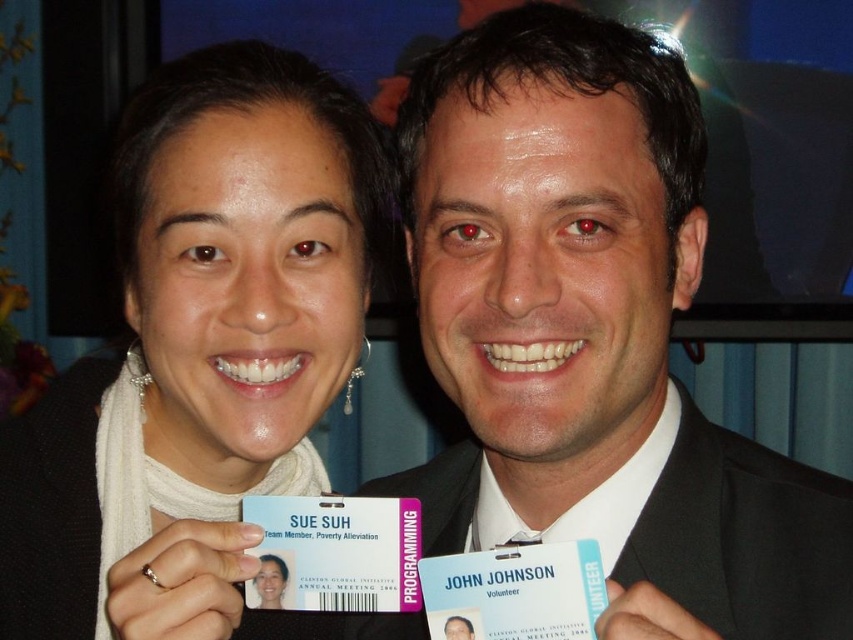
Question: Which object is positioned farthest from the white plastic badge at center?

Choices:
 (A) blue card at center
 (B) matte white scarf at upper left

Answer: (A)

Question: Estimate the real-world distances between objects in this image. Which object is closer to the black suit at center?

Choices:
 (A) white plastic badge at center
 (B) white fabric scarf at upper left
 (C) blue card at center
 (D) matte white scarf at upper left

Answer: (B)

Question: Can you confirm if white fabric scarf at upper left is positioned to the right of matte white scarf at upper left?

Choices:
 (A) yes
 (B) no

Answer: (B)

Question: Can you confirm if black suit at center is positioned to the right of white fabric scarf at upper left?

Choices:
 (A) yes
 (B) no

Answer: (A)

Question: Which point appears farthest from the camera in this image?

Choices:
 (A) (149, 241)
 (B) (305, 572)
 (C) (485, 600)

Answer: (A)

Question: Does white fabric scarf at upper left lie behind matte white scarf at upper left?

Choices:
 (A) no
 (B) yes

Answer: (A)